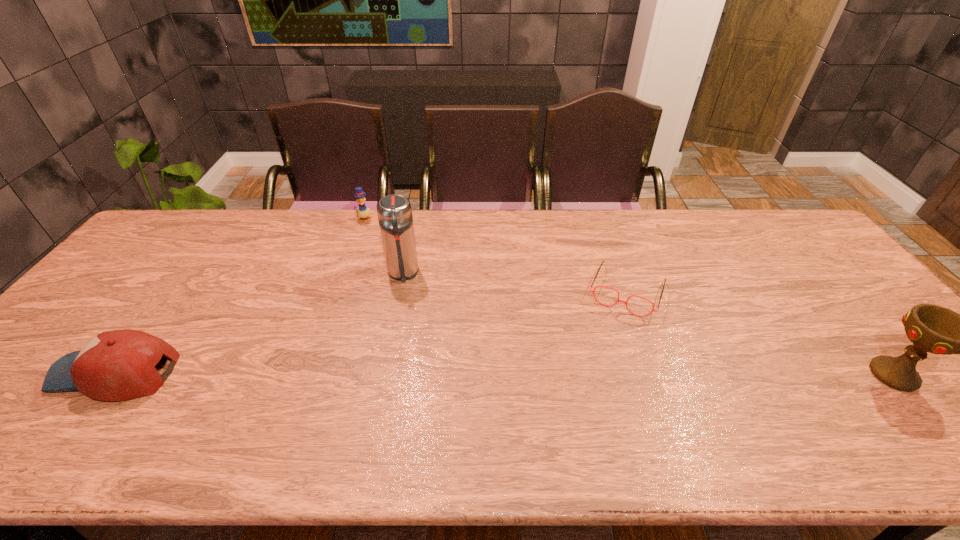
I want to click on the leftmost object, so click(x=118, y=365).

Identify the location of the rightmost object. (931, 328).

Where is `the fourth shortest object`? the fourth shortest object is located at coordinates (931, 328).

You are a GUI agent. You are given a task and a screenshot of the screen. Output one action in this format:
    pyautogui.click(x=<x>, y=<y>)
    Task: Click on the farthest object
    
    Given the screenshot: What is the action you would take?
    pyautogui.click(x=363, y=212)

At what (x,y) coordinates should I click in order to perform the action: click on the fourth object from right to left. Please return your answer as a coordinate pair (x, y). The width and height of the screenshot is (960, 540). Looking at the image, I should click on (363, 212).

This screenshot has width=960, height=540. Find the location of `the tallest object`. the tallest object is located at coordinates [394, 212].

Find the location of a particular element. The height and width of the screenshot is (540, 960). thermos bottle is located at coordinates (394, 212).

Identify the location of spectacles. (593, 291).

What are the coordinates of `the fourth object from left to right` in the screenshot? It's located at (593, 291).

At what (x,y) coordinates should I click in order to perform the action: click on free space located 0.250m on the back of the fourth shortest object. Please return your answer as a coordinate pair (x, y). This screenshot has height=540, width=960. Looking at the image, I should click on (819, 286).